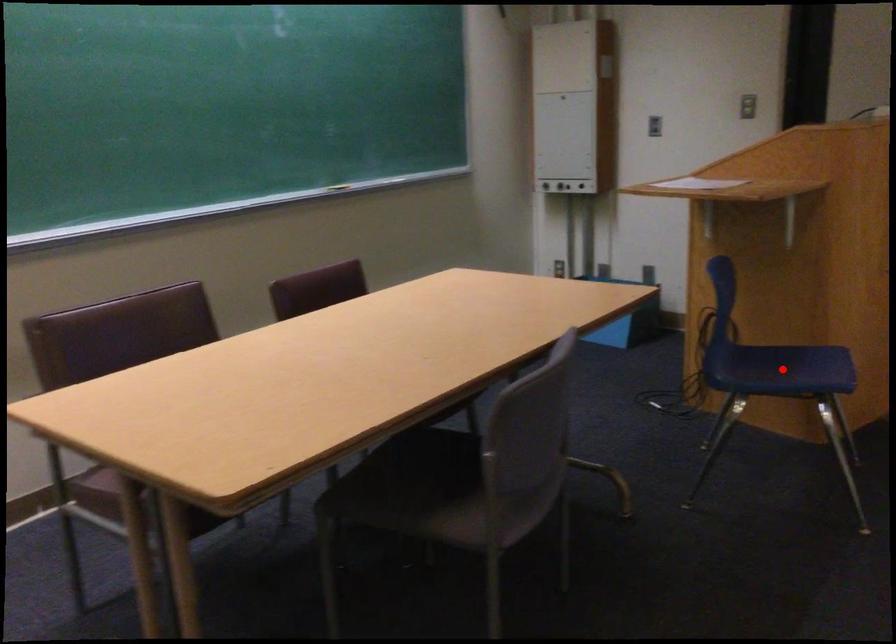
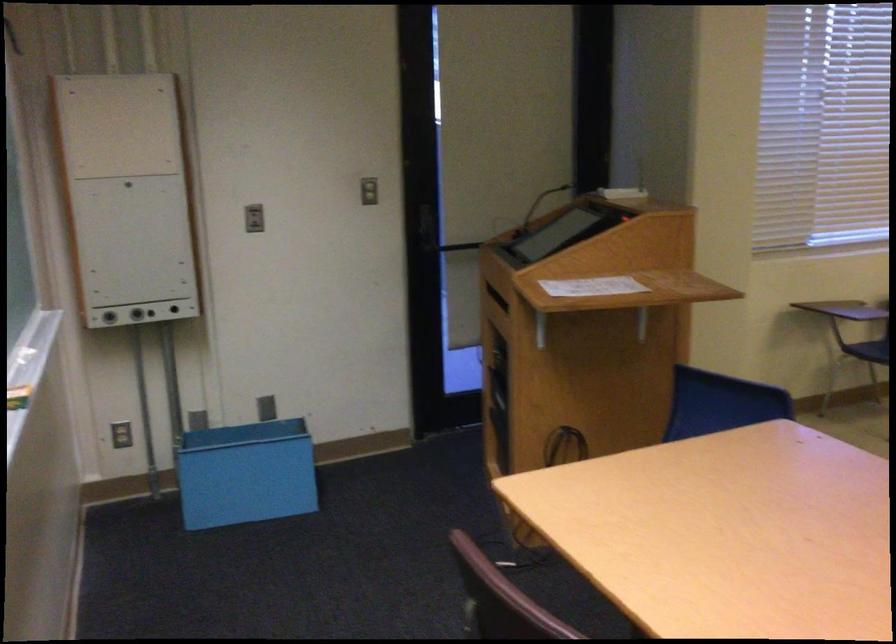
Question: I am providing you with two images of the same scene from different viewpoints. A red point is marked on the first image. Is the red point's position out of view in image 2?

Choices:
 (A) Yes
 (B) No

Answer: (A)